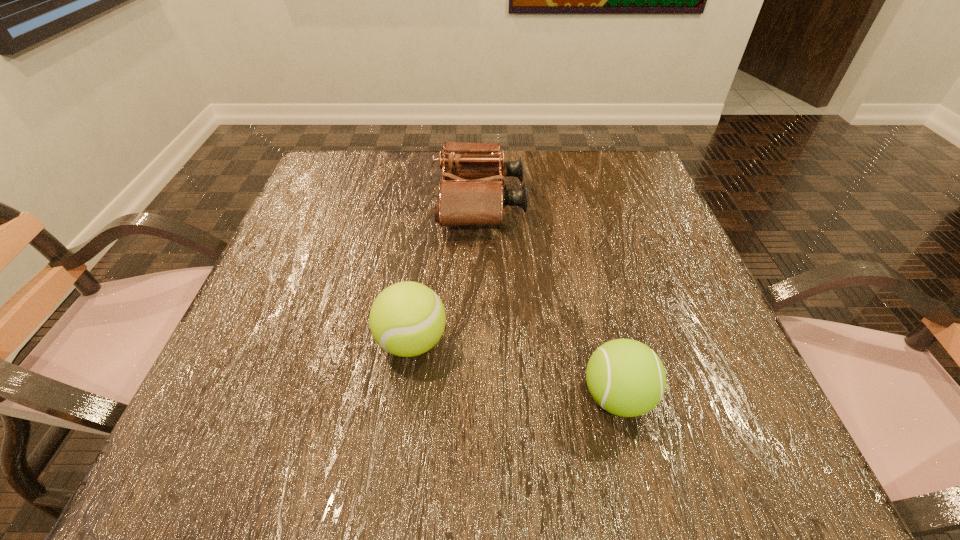
Locate an element on the screen. This screenshot has width=960, height=540. free space between the farthest object and the rightmost object is located at coordinates (548, 300).

The height and width of the screenshot is (540, 960). What are the coordinates of `empty space that is in between the left tennis ball and the rightmost object` in the screenshot? It's located at (515, 369).

This screenshot has width=960, height=540. Identify the location of free space between the left tennis ball and the farthest object. (445, 272).

The width and height of the screenshot is (960, 540). I want to click on free spot between the left tennis ball and the right tennis ball, so click(515, 369).

Where is `blank region between the left tennis ball and the binoculars`? The height and width of the screenshot is (540, 960). blank region between the left tennis ball and the binoculars is located at coordinates (445, 272).

Find the location of a particular element. The image size is (960, 540). vacant point located between the farthest object and the left tennis ball is located at coordinates [x=445, y=272].

Identify which object is located as the second nearest to the right tennis ball. Please provide its 2D coordinates. Your answer should be formatted as a tuple, i.e. [(x, y)], where the tuple contains the x and y coordinates of a point satisfying the conditions above.

[(470, 194)]

Identify which object is the second closest to the rightmost object. Please provide its 2D coordinates. Your answer should be formatted as a tuple, i.e. [(x, y)], where the tuple contains the x and y coordinates of a point satisfying the conditions above.

[(470, 194)]

Find the location of a particular element. The width and height of the screenshot is (960, 540). vacant space that satisfies the following two spatial constraints: 1. through the eyepieces of the rightmost object; 2. on the left side of the farthest object is located at coordinates (479, 397).

Identify the location of free spot that satisfies the following two spatial constraints: 1. through the eyepieces of the right tennis ball; 2. on the right side of the binoculars. This screenshot has height=540, width=960. (479, 397).